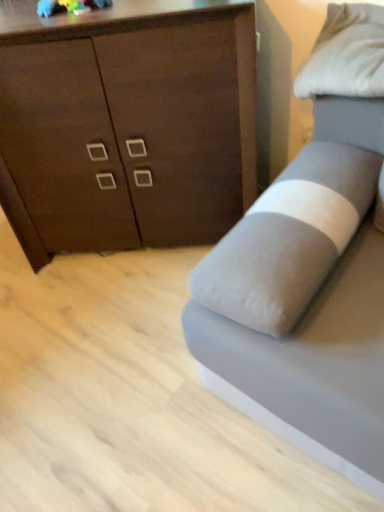
Locate an element on the screen. dark wood cabinet at upper left is located at coordinates (127, 124).

Considering the sizes of objects white soft pillow at upper right and gray fabric studio couch at right in the image provided, who is shorter, white soft pillow at upper right or gray fabric studio couch at right?

white soft pillow at upper right.

Does white soft pillow at upper right have a smaller size compared to gray fabric studio couch at right?

Yes.

I want to click on studio couch below the white soft pillow at upper right (from a real-world perspective), so click(312, 366).

From the image's perspective, which is above, dark wood cabinet at upper left or gray fabric studio couch at right?

dark wood cabinet at upper left.

Does dark wood cabinet at upper left have a greater height compared to gray fabric studio couch at right?

Yes, dark wood cabinet at upper left is taller than gray fabric studio couch at right.

I want to click on chest of drawers above the gray fabric studio couch at right (from the image's perspective), so click(x=127, y=124).

From the picture: Is dark wood cabinet at upper left facing away from gray fabric studio couch at right?

No.

Is white soft pillow at upper right inside or outside of dark wood cabinet at upper left?

white soft pillow at upper right is not enclosed by dark wood cabinet at upper left.

Can you confirm if white soft pillow at upper right is taller than dark wood cabinet at upper left?

In fact, white soft pillow at upper right may be shorter than dark wood cabinet at upper left.

Considering the sizes of objects white soft pillow at upper right and dark wood cabinet at upper left in the image provided, who is bigger, white soft pillow at upper right or dark wood cabinet at upper left?

With larger size is dark wood cabinet at upper left.

This screenshot has height=512, width=384. I want to click on pillow in front of the dark wood cabinet at upper left, so pyautogui.click(x=346, y=54).

Does point (344, 365) come behind point (356, 27)?

No, it is not.

Looking at this image, does gray fabric studio couch at right turn towards white soft pillow at upper right?

No, gray fabric studio couch at right is not turned towards white soft pillow at upper right.

From the image's perspective, which one is positioned lower, gray fabric studio couch at right or white soft pillow at upper right?

gray fabric studio couch at right, from the image's perspective.

Does gray fabric studio couch at right have a greater width compared to dark wood cabinet at upper left?

Indeed, gray fabric studio couch at right has a greater width compared to dark wood cabinet at upper left.

In the scene shown: From a real-world perspective, is gray fabric studio couch at right positioned above or below dark wood cabinet at upper left?

From a real-world perspective, gray fabric studio couch at right is physically below dark wood cabinet at upper left.

Who is shorter, gray fabric studio couch at right or dark wood cabinet at upper left?

Standing shorter between the two is gray fabric studio couch at right.

From the image's perspective, which object appears higher, dark wood cabinet at upper left or white soft pillow at upper right?

white soft pillow at upper right.

Considering the sizes of dark wood cabinet at upper left and white soft pillow at upper right in the image, is dark wood cabinet at upper left bigger or smaller than white soft pillow at upper right?

In the image, dark wood cabinet at upper left appears to be larger than white soft pillow at upper right.

How different are the orientations of dark wood cabinet at upper left and white soft pillow at upper right in degrees?

36 degrees separate the facing orientations of dark wood cabinet at upper left and white soft pillow at upper right.

Considering the sizes of objects dark wood cabinet at upper left and white soft pillow at upper right in the image provided, who is wider, dark wood cabinet at upper left or white soft pillow at upper right?

With larger width is dark wood cabinet at upper left.

Image resolution: width=384 pixels, height=512 pixels. Identify the location of studio couch below the white soft pillow at upper right (from a real-world perspective). (312, 366).

The width and height of the screenshot is (384, 512). In order to click on studio couch that is in front of the dark wood cabinet at upper left in this screenshot , I will do `click(312, 366)`.

Looking at the image, which one is located closer to gray fabric studio couch at right, dark wood cabinet at upper left or white soft pillow at upper right?

white soft pillow at upper right lies closer to gray fabric studio couch at right than the other object.

Looking at the image, which one is located further to dark wood cabinet at upper left, white soft pillow at upper right or gray fabric studio couch at right?

gray fabric studio couch at right is positioned further to the anchor dark wood cabinet at upper left.

Based on their spatial positions, is white soft pillow at upper right or dark wood cabinet at upper left further from gray fabric studio couch at right?

Based on the image, dark wood cabinet at upper left appears to be further to gray fabric studio couch at right.

Looking at this image, based on their spatial positions, is gray fabric studio couch at right or white soft pillow at upper right further from dark wood cabinet at upper left?

gray fabric studio couch at right is positioned further to the anchor dark wood cabinet at upper left.

When comparing their distances from white soft pillow at upper right, does gray fabric studio couch at right or dark wood cabinet at upper left seem further?

dark wood cabinet at upper left is further to white soft pillow at upper right.

Estimate the real-world distances between objects in this image. Which object is further from white soft pillow at upper right, dark wood cabinet at upper left or gray fabric studio couch at right?

dark wood cabinet at upper left is positioned further to the anchor white soft pillow at upper right.

Find the location of `studio couch between dark wood cabinet at upper left and white soft pillow at upper right from left to right`. studio couch between dark wood cabinet at upper left and white soft pillow at upper right from left to right is located at coordinates (312, 366).